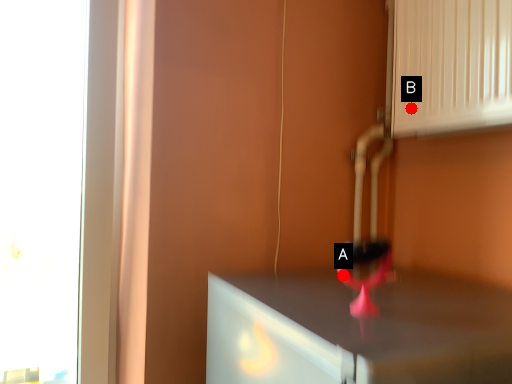
Question: Two points are circled on the image, labeled by A and B beside each circle. Which point is farther to the camera?

Choices:
 (A) A is further
 (B) B is further

Answer: (B)